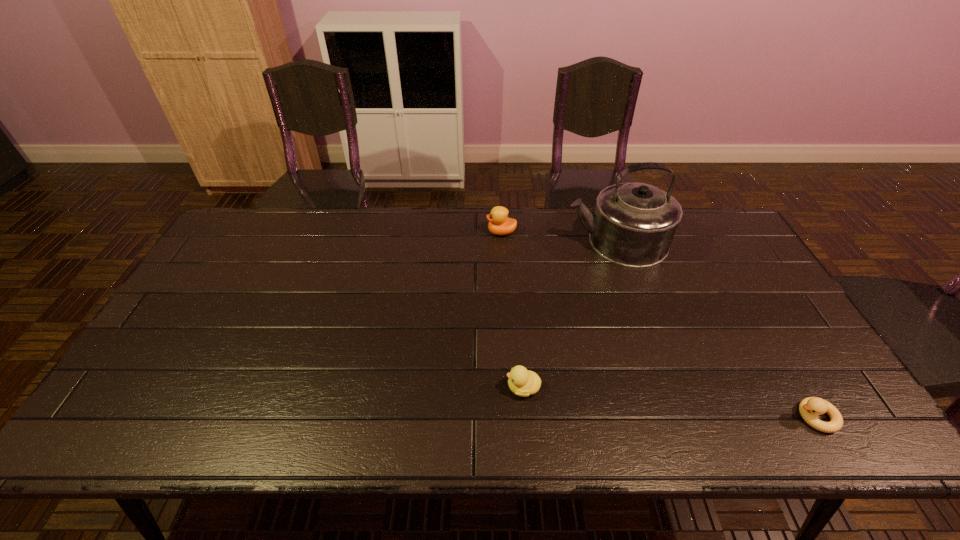
At what (x,y) coordinates should I click in order to perform the action: click on the tallest object. Please return your answer as a coordinate pair (x, y). The width and height of the screenshot is (960, 540). Looking at the image, I should click on coord(633,225).

Locate an element on the screen. The width and height of the screenshot is (960, 540). the second object from right to left is located at coordinates (633, 225).

Find the location of a particular element. Image resolution: width=960 pixels, height=540 pixels. the tallest duckling is located at coordinates (499, 223).

Locate an element on the screen. This screenshot has height=540, width=960. the second tallest object is located at coordinates (499, 223).

Locate an element on the screen. The width and height of the screenshot is (960, 540). the rightmost duckling is located at coordinates [x=810, y=407].

The image size is (960, 540). What are the coordinates of `free space located with the spout at the front of the third object from left to right` in the screenshot? It's located at (466, 241).

The width and height of the screenshot is (960, 540). In order to click on free space located 0.060m with the spout at the front of the third object from left to right in this screenshot , I will do `click(546, 241)`.

What are the coordinates of `vacant space situated 0.200m with the spout at the front of the third object from left to right` in the screenshot? It's located at click(x=504, y=241).

You are a GUI agent. You are given a task and a screenshot of the screen. Output one action in this format:
    pyautogui.click(x=<x>, y=<y>)
    Task: Click on the vacant point located 0.310m on the face of the farthest duckling
    The width and height of the screenshot is (960, 540).
    Given the screenshot: What is the action you would take?
    pyautogui.click(x=396, y=232)

This screenshot has width=960, height=540. Identify the location of free spot located 0.110m on the face of the farthest duckling. (454, 232).